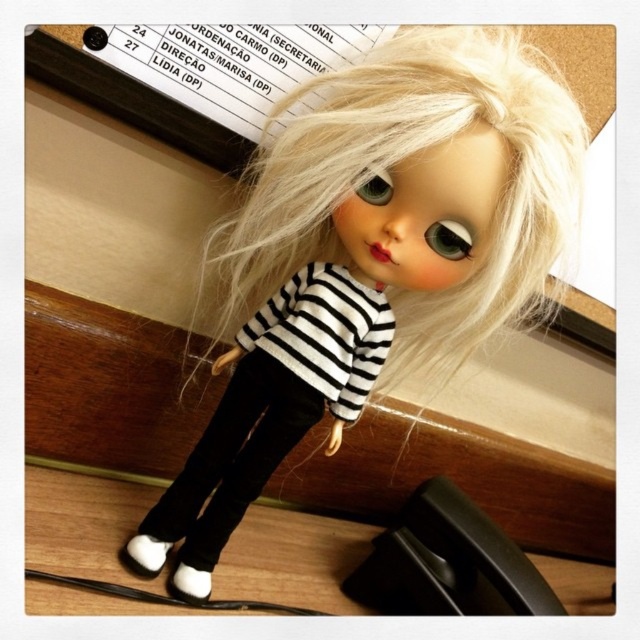
Question: Can you confirm if white matte shoe at lower left is positioned above white matte shoe at lower center?

Choices:
 (A) yes
 (B) no

Answer: (A)

Question: Which object appears closest to the camera in this image?

Choices:
 (A) matte black doll at center
 (B) white matte shoe at lower left
 (C) white matte shoe at lower center

Answer: (A)

Question: Which of the following is the closest to the observer?

Choices:
 (A) (182, 598)
 (B) (156, 547)

Answer: (A)

Question: Where is matte black doll at center located in relation to white matte shoe at lower center in the image?

Choices:
 (A) below
 (B) above

Answer: (B)

Question: Is the position of white matte shoe at lower left less distant than that of white matte shoe at lower center?

Choices:
 (A) no
 (B) yes

Answer: (B)

Question: Which of these objects is positioned farthest from the matte black doll at center?

Choices:
 (A) white matte shoe at lower left
 (B) white matte shoe at lower center

Answer: (B)